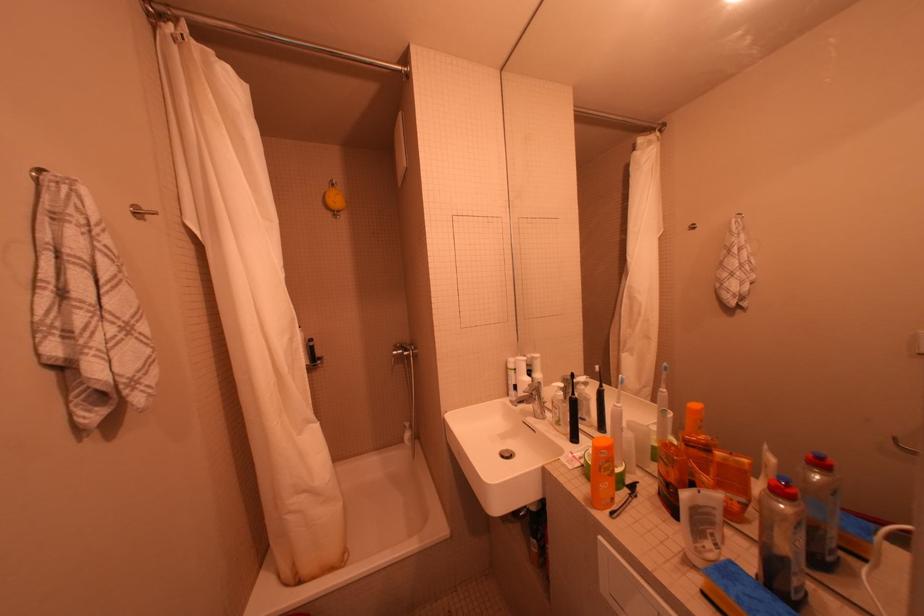
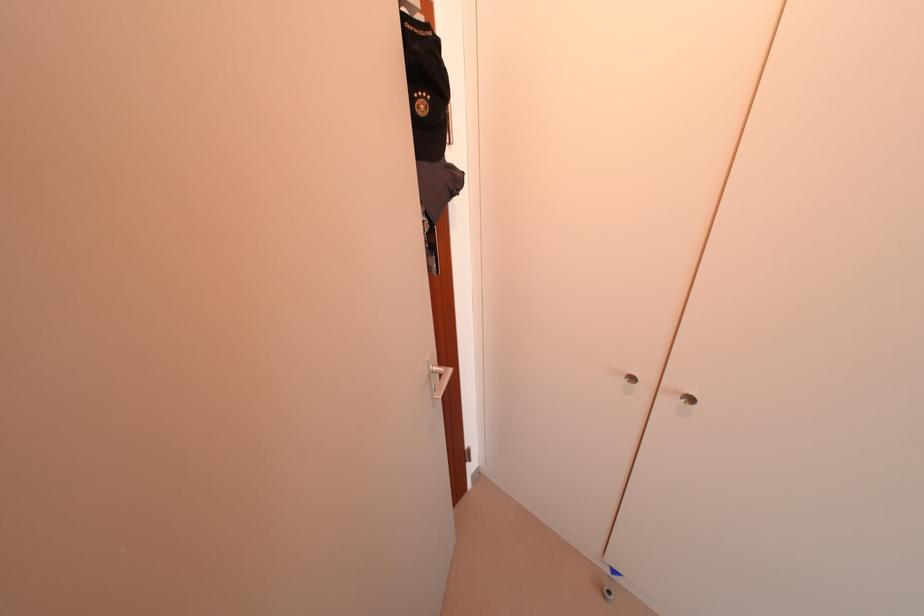
First-person continuous shooting, in which direction is the camera rotating?

The camera rotated toward right-down.